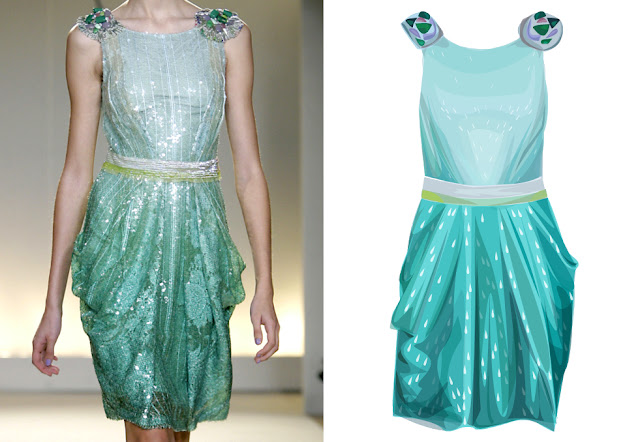
Locate an element on the screen. The width and height of the screenshot is (640, 442). dark beige background is located at coordinates (24, 185).